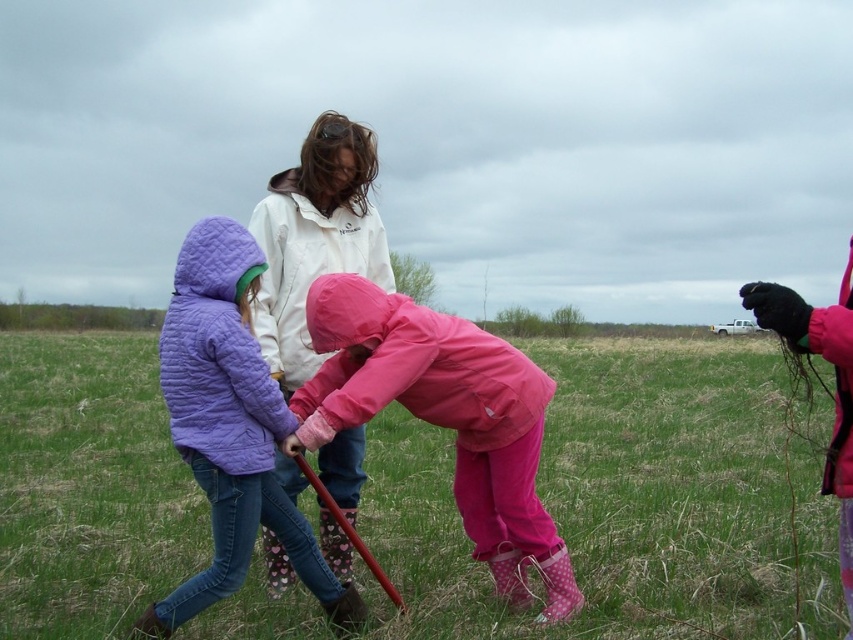
Question: Is green grass at center smaller than pink matte raincoat at center?

Choices:
 (A) yes
 (B) no

Answer: (B)

Question: Does pink matte raincoat at center appear on the right side of quilted purple jacket at center?

Choices:
 (A) no
 (B) yes

Answer: (B)

Question: Among these objects, which one is nearest to the camera?

Choices:
 (A) quilted purple jacket at center
 (B) pink matte raincoat at center

Answer: (A)

Question: Does green grass at center have a smaller size compared to pink matte raincoat at center?

Choices:
 (A) yes
 (B) no

Answer: (B)

Question: Among these objects, which one is farthest from the camera?

Choices:
 (A) green grass at center
 (B) quilted purple jacket at center
 (C) pink matte raincoat at center

Answer: (A)

Question: Which point is farther to the camera?

Choices:
 (A) quilted purple jacket at center
 (B) pink matte raincoat at center

Answer: (B)